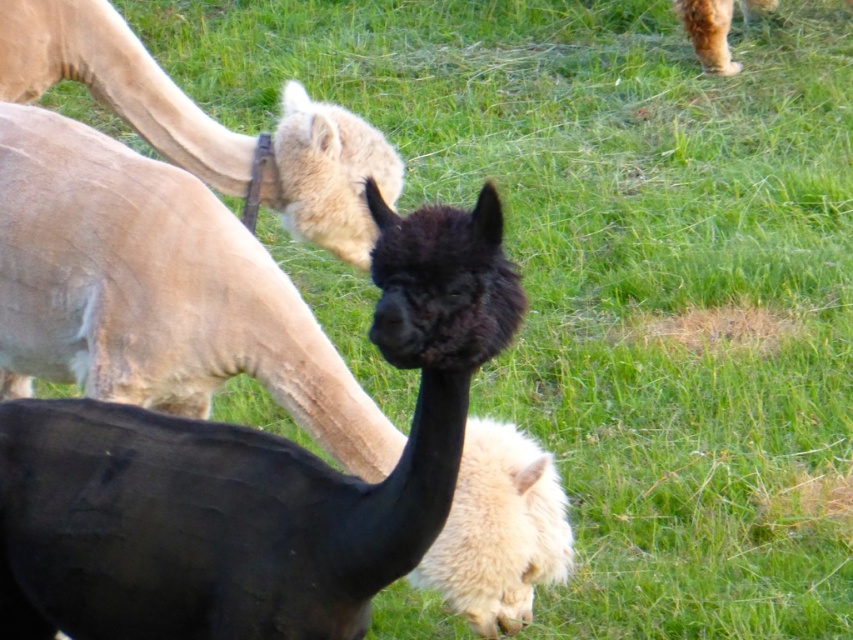
Question: Observing the image, what is the correct spatial positioning of black fuzzy alpaca at center in reference to light beige woolen camel at upper left?

Choices:
 (A) below
 (B) above

Answer: (A)

Question: Which object is farther from the camera taking this photo?

Choices:
 (A) black fuzzy alpaca at center
 (B) light beige woolen camel at upper left

Answer: (B)

Question: Does black fuzzy alpaca at center appear under light beige woolen camel at upper left?

Choices:
 (A) yes
 (B) no

Answer: (A)

Question: From the image, what is the correct spatial relationship of black fuzzy alpaca at center in relation to light beige woolen camel at upper left?

Choices:
 (A) left
 (B) right

Answer: (B)

Question: Which of the following is the farthest from the observer?

Choices:
 (A) (161, 76)
 (B) (271, 588)

Answer: (A)